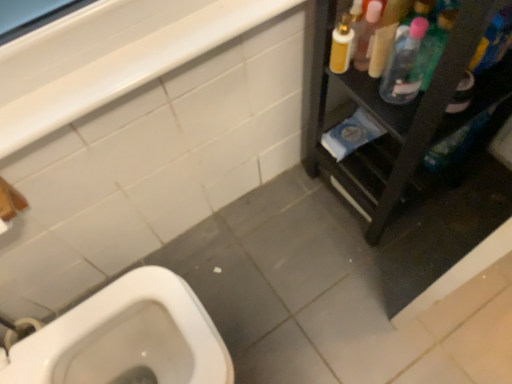
Question: Is black plastic shelf at right further to camera compared to white glossy balustrade at upper left?

Choices:
 (A) no
 (B) yes

Answer: (A)

Question: Is black plastic shelf at right bigger than white glossy balustrade at upper left?

Choices:
 (A) yes
 (B) no

Answer: (A)

Question: Considering the relative sizes of black plastic shelf at right and white glossy balustrade at upper left in the image provided, is black plastic shelf at right shorter than white glossy balustrade at upper left?

Choices:
 (A) no
 (B) yes

Answer: (A)

Question: From a real-world perspective, is black plastic shelf at right below white glossy balustrade at upper left?

Choices:
 (A) no
 (B) yes

Answer: (B)

Question: Is black plastic shelf at right not close to white glossy balustrade at upper left?

Choices:
 (A) no
 (B) yes

Answer: (A)

Question: In the image, is translucent plastic spray bottle at upper right, which is the first cleaning product from right to left, on the left side or the right side of black plastic shelf at right?

Choices:
 (A) left
 (B) right

Answer: (A)

Question: From a real-world perspective, is translucent plastic spray bottle at upper right, placed as the 2th cleaning product when sorted from left to right, physically located above or below black plastic shelf at right?

Choices:
 (A) below
 (B) above

Answer: (B)

Question: Considering the positions of point (430, 46) and point (473, 49), is point (430, 46) closer or farther from the camera than point (473, 49)?

Choices:
 (A) farther
 (B) closer

Answer: (A)

Question: Considering the positions of translucent plastic spray bottle at upper right, which is the first cleaning product from right to left, and black plastic shelf at right in the image, is translucent plastic spray bottle at upper right, which is the first cleaning product from right to left, bigger or smaller than black plastic shelf at right?

Choices:
 (A) small
 (B) big

Answer: (A)

Question: From a real-world perspective, relative to white glossy balustrade at upper left, is clear plastic bottle at upper right, acting as the second cleaning product starting from the right, vertically above or below?

Choices:
 (A) below
 (B) above

Answer: (A)

Question: Is clear plastic bottle at upper right, placed as the first cleaning product when sorted from left to right, inside or outside of white glossy balustrade at upper left?

Choices:
 (A) outside
 (B) inside

Answer: (A)

Question: In terms of height, does clear plastic bottle at upper right, acting as the second cleaning product starting from the right, look taller or shorter compared to white glossy balustrade at upper left?

Choices:
 (A) tall
 (B) short

Answer: (A)

Question: Is clear plastic bottle at upper right, placed as the first cleaning product when sorted from left to right, to the left or to the right of white glossy balustrade at upper left in the image?

Choices:
 (A) right
 (B) left

Answer: (A)

Question: From the image's perspective, is white glossy balustrade at upper left positioned above or below translucent plastic spray bottle at upper right, placed as the 2th cleaning product when sorted from left to right?

Choices:
 (A) above
 (B) below

Answer: (B)

Question: Considering the positions of white glossy balustrade at upper left and translucent plastic spray bottle at upper right, which is the first cleaning product from right to left, in the image, is white glossy balustrade at upper left taller or shorter than translucent plastic spray bottle at upper right, which is the first cleaning product from right to left,?

Choices:
 (A) tall
 (B) short

Answer: (B)